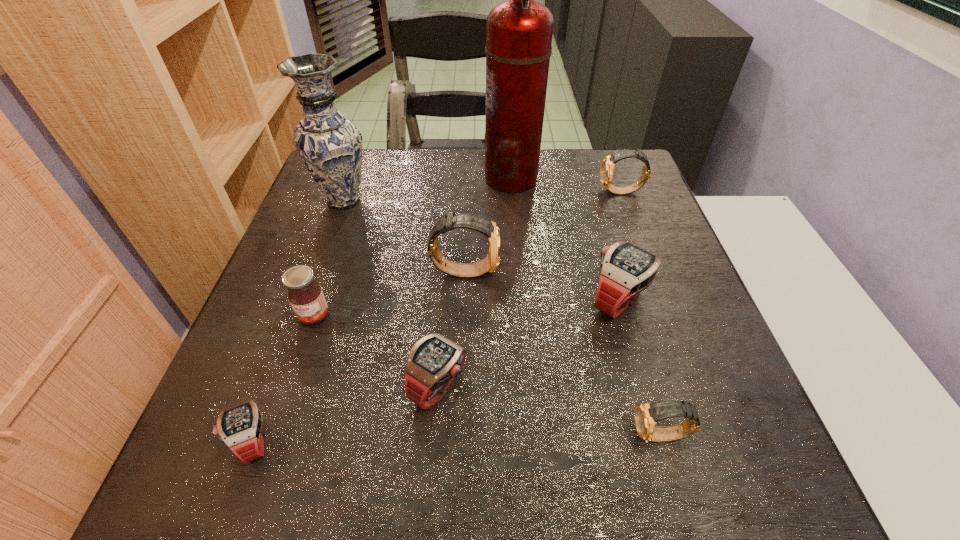
Where is `fire extinguisher located at the far edge`? This screenshot has height=540, width=960. fire extinguisher located at the far edge is located at coordinates (519, 31).

Identify the location of vase located at the far edge. The image size is (960, 540). (330, 146).

Where is `watch present at the far edge`? watch present at the far edge is located at coordinates (606, 171).

Find the location of a particular element. The image size is (960, 540). vase that is at the left edge is located at coordinates (330, 146).

At what (x,y) coordinates should I click in order to perform the action: click on jam present at the left edge. Please return your answer as a coordinate pair (x, y). The width and height of the screenshot is (960, 540). Looking at the image, I should click on point(305,295).

I want to click on watch at the left edge, so click(x=240, y=427).

Locate an element on the screen. This screenshot has width=960, height=540. object situated at the far left corner is located at coordinates (330, 146).

Find the location of a particular element. The height and width of the screenshot is (540, 960). object that is positioned at the near left corner is located at coordinates (240, 427).

Image resolution: width=960 pixels, height=540 pixels. Identify the location of object that is positioned at the far right corner. (606, 171).

At what (x,y) coordinates should I click in order to perform the action: click on object present at the near right corner. Please return your answer as a coordinate pair (x, y). The width and height of the screenshot is (960, 540). Looking at the image, I should click on (647, 415).